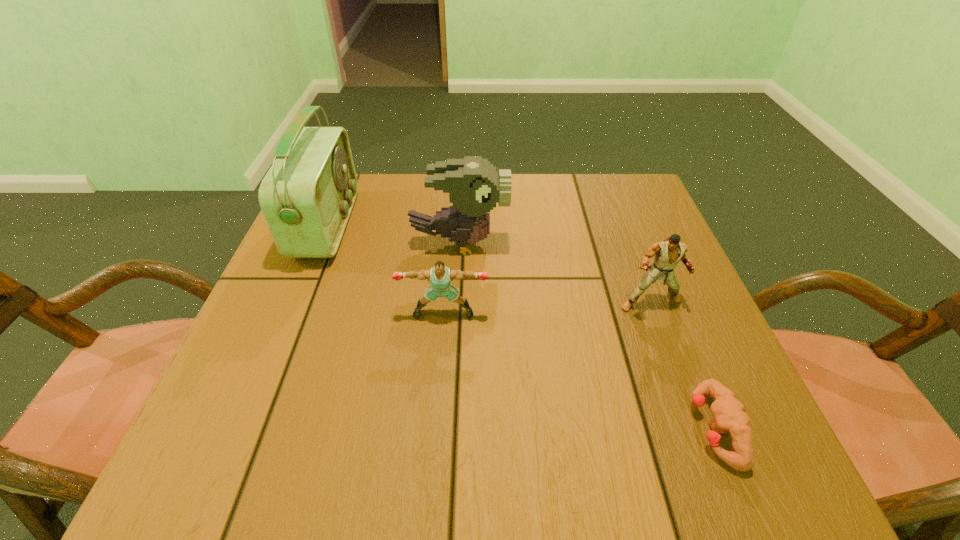
Where is `free space that satisfies the following two spatial constraints: 1. at the beak of the bird; 2. on the front-facing side of the leftmost puncher`? This screenshot has height=540, width=960. free space that satisfies the following two spatial constraints: 1. at the beak of the bird; 2. on the front-facing side of the leftmost puncher is located at coordinates (456, 313).